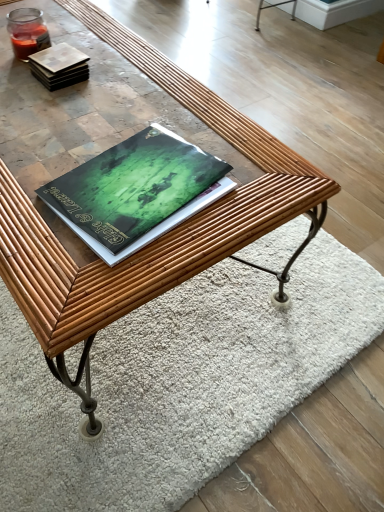
Identify the location of vacant region in front of matte brown tile at upper left, arranged as the 1th book when viewed from the back. (61, 112).